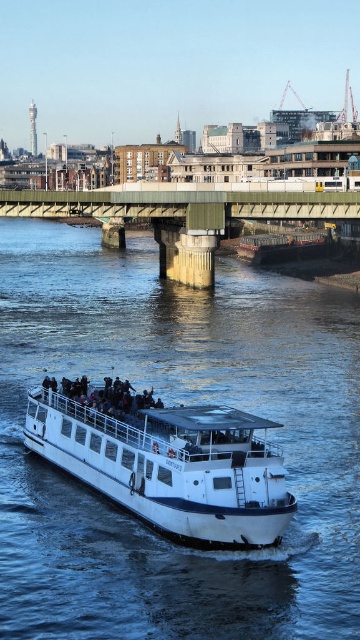
Question: Does white glossy boat at center appear on the left side of green concrete bridge at center?

Choices:
 (A) yes
 (B) no

Answer: (B)

Question: Among these objects, which one is farthest from the camera?

Choices:
 (A) blue water at center
 (B) white matte boat at center
 (C) green concrete bridge at center

Answer: (C)

Question: Can you confirm if green concrete bridge at center is bigger than metallic gray barge at center?

Choices:
 (A) no
 (B) yes

Answer: (B)

Question: Which object is farther from the camera taking this photo?

Choices:
 (A) white glossy boat at center
 (B) blue water at center

Answer: (A)

Question: Does white matte boat at center come in front of metallic gray barge at center?

Choices:
 (A) yes
 (B) no

Answer: (A)

Question: Which of the following is the farthest from the observer?

Choices:
 (A) (105, 410)
 (B) (10, 588)
 (C) (240, 204)

Answer: (C)